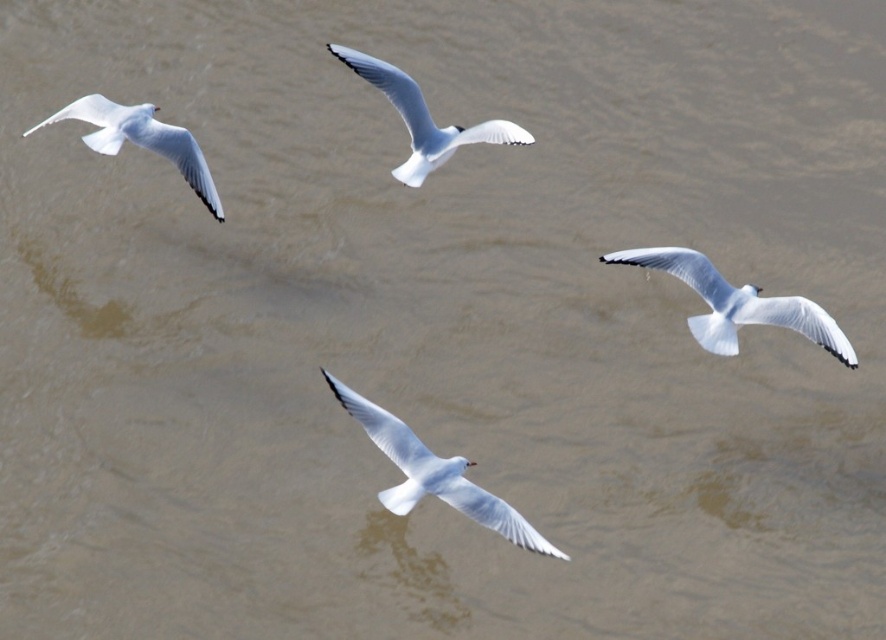
What do you see at coordinates (736, 304) in the screenshot?
I see `white matte seagull at lower right` at bounding box center [736, 304].

Is white matte seagull at lower right to the left of white matte bird at center from the viewer's perspective?

No, white matte seagull at lower right is not to the left of white matte bird at center.

The width and height of the screenshot is (886, 640). I want to click on white matte seagull at lower right, so click(x=736, y=304).

Between white matte bird at center and white matte seagull at center, which one appears on the right side from the viewer's perspective?

white matte bird at center

Can you confirm if white matte bird at center is positioned to the right of white matte seagull at center?

Yes, white matte bird at center is to the right of white matte seagull at center.

What do you see at coordinates (434, 474) in the screenshot? Image resolution: width=886 pixels, height=640 pixels. I see `white matte bird at center` at bounding box center [434, 474].

Locate an element on the screen. Image resolution: width=886 pixels, height=640 pixels. white matte bird at center is located at coordinates (434, 474).

The height and width of the screenshot is (640, 886). I want to click on white matte seagull at lower right, so click(x=736, y=304).

Which is in front, point (735, 298) or point (129, 136)?

Point (735, 298)

Between point (674, 262) and point (196, 145), which one is positioned behind?

Point (196, 145)

Locate an element on the screen. The height and width of the screenshot is (640, 886). white matte seagull at lower right is located at coordinates (736, 304).